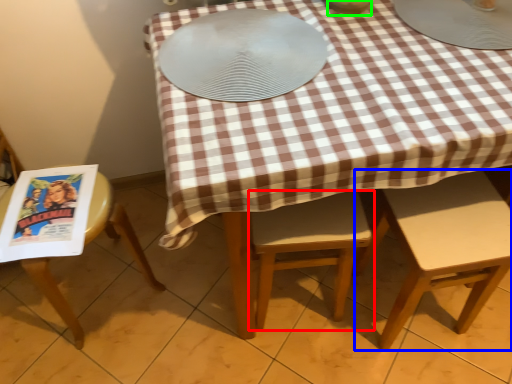
Question: Which object is positioned farthest from chair (highlighted by a red box)? Select from chair (highlighted by a blue box) and tableware (highlighted by a green box).

Choices:
 (A) chair
 (B) tableware

Answer: (B)